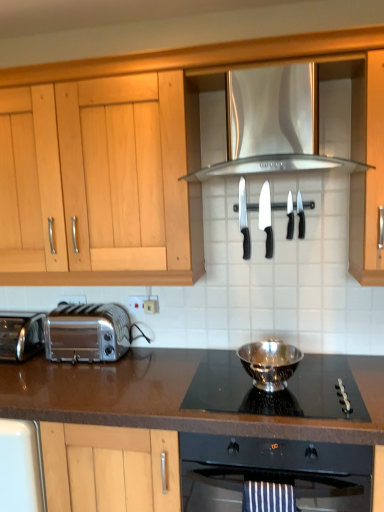
Locate an element on the screen. This screenshot has height=512, width=384. vacant space to the left of polished stainless steel bowl at center is located at coordinates (222, 387).